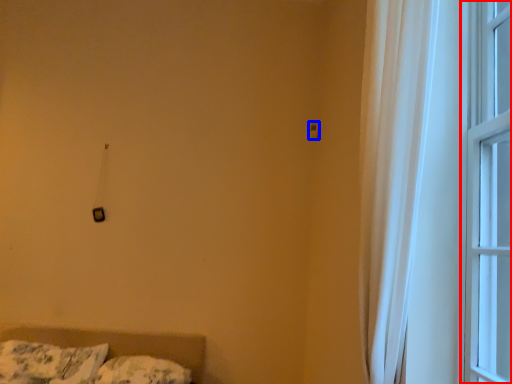
Question: Which point is further to the camera, window (highlighted by a red box) or light switch (highlighted by a blue box)?

Choices:
 (A) window
 (B) light switch

Answer: (B)